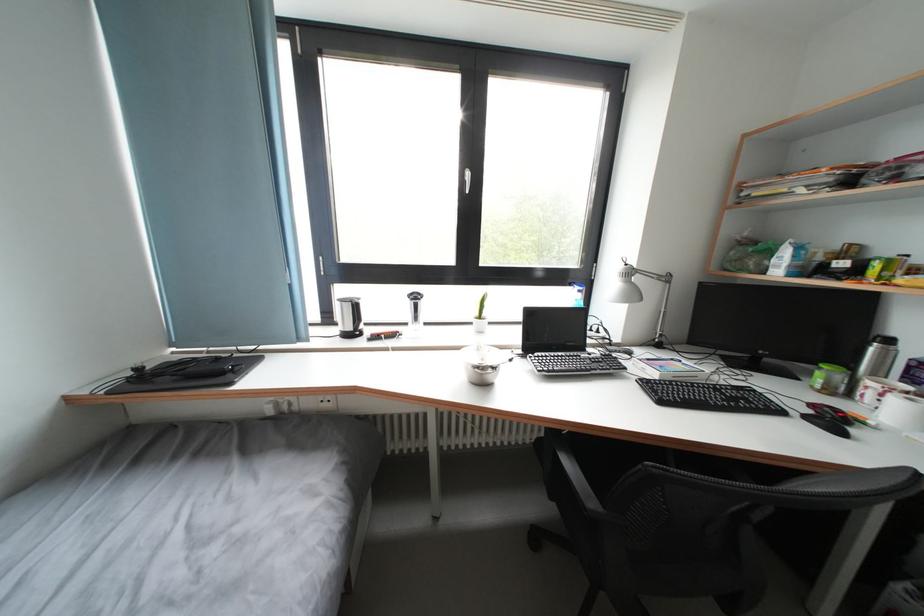
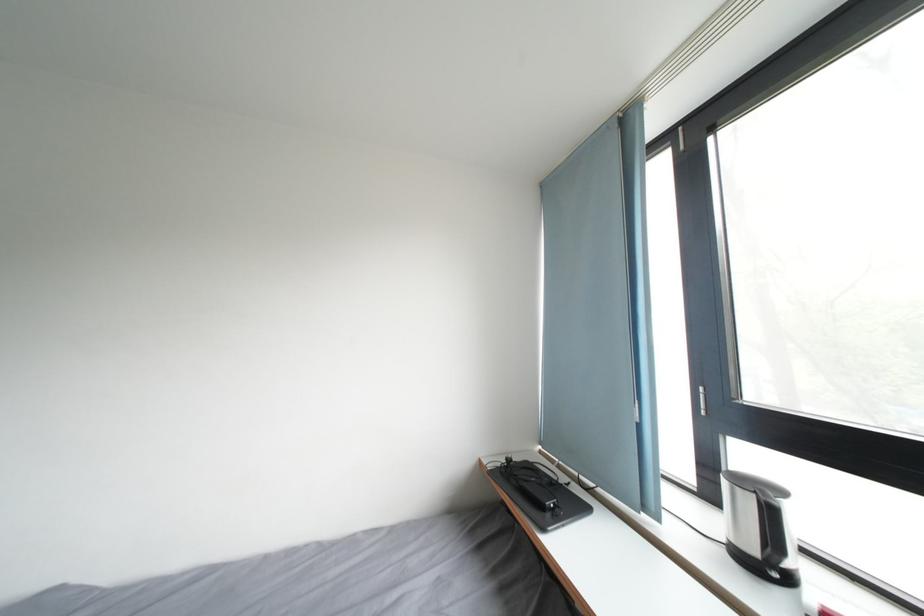
Question: The camera is either moving clockwise (left) or counter-clockwise (right) around the object. The first image is from the beginning of the video and the second image is from the end. Is the camera moving left or right when shooting the video?

Choices:
 (A) Left
 (B) Right

Answer: (B)